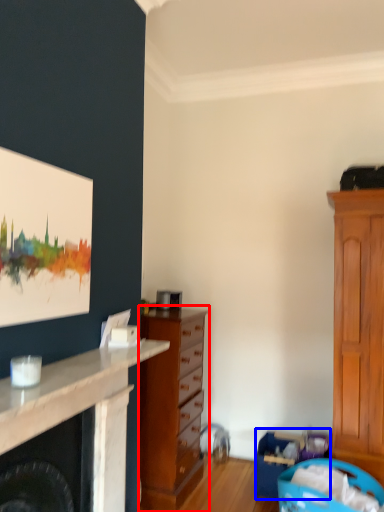
Question: Which object appears farthest to the camera in this image, chest of drawers (highlighted by a red box) or laundry basket (highlighted by a blue box)?

Choices:
 (A) chest of drawers
 (B) laundry basket

Answer: (B)